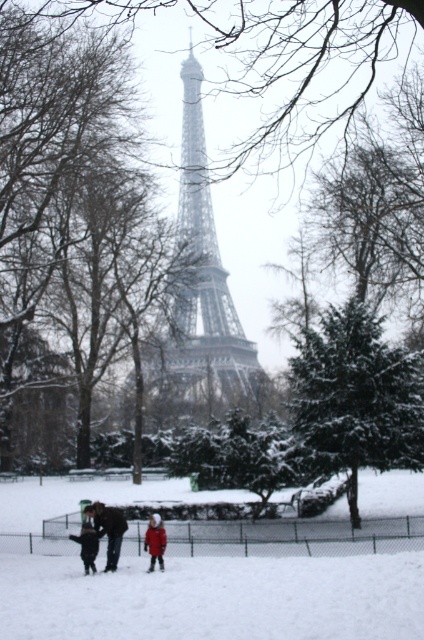
Question: Does metallic silver tower at center appear on the right side of red woolen coat at center?

Choices:
 (A) yes
 (B) no

Answer: (A)

Question: Which object is the farthest from the white fluffy snow at lower center?

Choices:
 (A) dark gray coat at lower left
 (B) metallic silver tower at center
 (C) dark brown leather coat at center
 (D) dark blue jeans at lower left

Answer: (B)

Question: Based on their relative distances, which object is farther from the dark brown leather coat at center?

Choices:
 (A) metallic silver tower at center
 (B) dark blue jeans at lower left
 (C) dark gray coat at lower left
 (D) red woolen coat at center

Answer: (A)

Question: Can you confirm if white fluffy snow at lower center is positioned below dark gray coat at lower left?

Choices:
 (A) yes
 (B) no

Answer: (A)

Question: Does red woolen coat at center come in front of dark gray coat at lower left?

Choices:
 (A) no
 (B) yes

Answer: (A)

Question: Which object appears closest to the camera in this image?

Choices:
 (A) white fluffy snow at lower center
 (B) dark brown leather coat at center

Answer: (A)